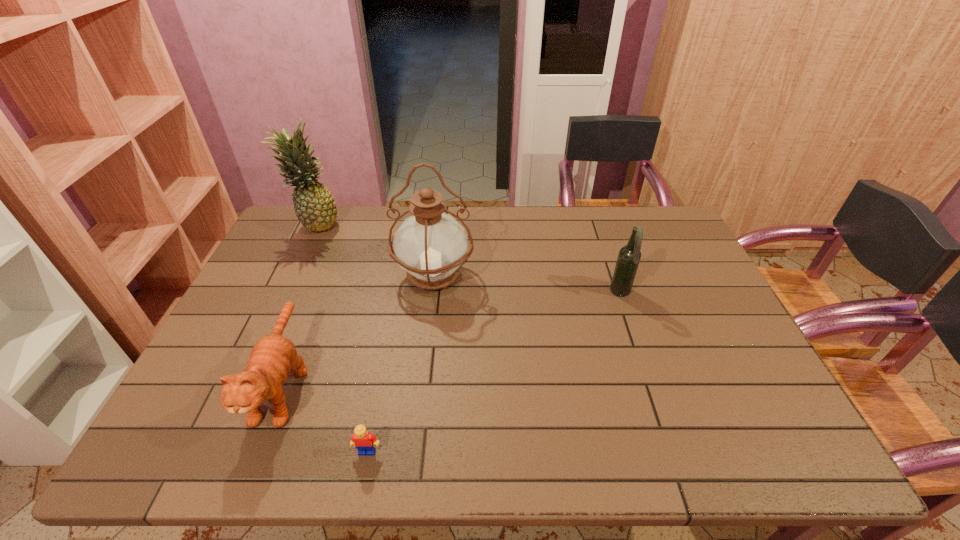
Identify which object is located as the second nearest to the farthest object. Please provide its 2D coordinates. Your answer should be formatted as a tuple, i.e. [(x, y)], where the tuple contains the x and y coordinates of a point satisfying the conditions above.

[(272, 358)]

The image size is (960, 540). In order to click on blank area in the image that satisfies the following two spatial constraints: 1. on the front side of the oil lamp; 2. on the right side of the pineapple in this screenshot , I will do `click(293, 275)`.